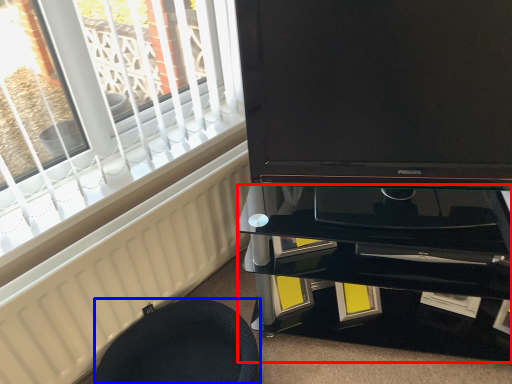
Question: Which object is closer to the camera taking this photo, tv cabinet (highlighted by a red box) or furniture (highlighted by a blue box)?

Choices:
 (A) tv cabinet
 (B) furniture

Answer: (B)